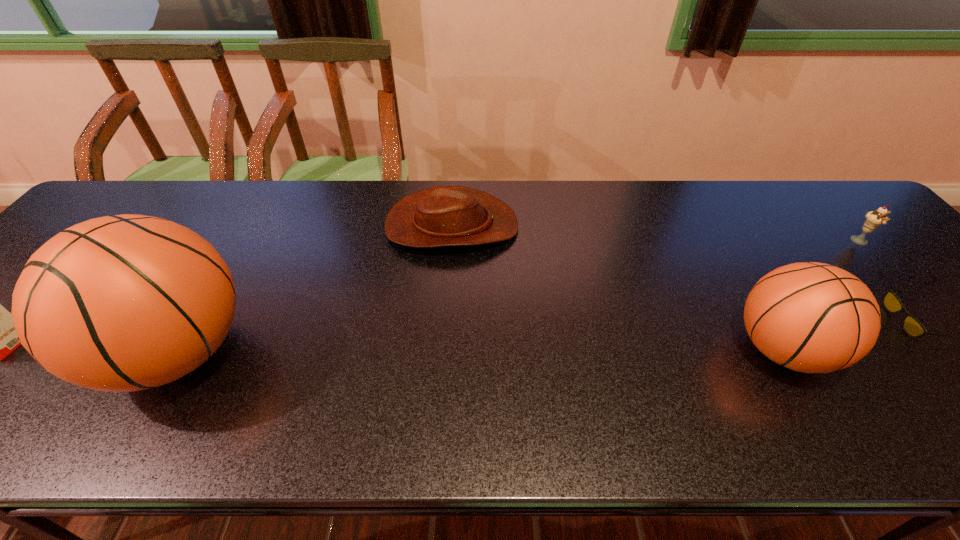
The image size is (960, 540). Identify the location of the taller basketball. point(124,303).

Where is `the second object from left to right`? Image resolution: width=960 pixels, height=540 pixels. the second object from left to right is located at coordinates (124, 303).

This screenshot has width=960, height=540. I want to click on the right basketball, so click(x=811, y=317).

Where is `the shorter basketball`? The height and width of the screenshot is (540, 960). the shorter basketball is located at coordinates (811, 317).

At what (x,y) coordinates should I click in order to perform the action: click on the fifth tallest object. Please return your answer as a coordinate pair (x, y). The width and height of the screenshot is (960, 540). Looking at the image, I should click on (440, 216).

Identify the location of cowboy hat. (440, 216).

This screenshot has height=540, width=960. I want to click on icecream, so click(873, 220).

Locate an element on the screen. The width and height of the screenshot is (960, 540). sunglasses is located at coordinates (912, 326).

Locate an element on the screen. Image resolution: width=960 pixels, height=540 pixels. free location located 0.300m on the right of the tallest object is located at coordinates (395, 353).

In order to click on vacant space situated on the left of the shorter basketball in this screenshot , I will do [x=708, y=349].